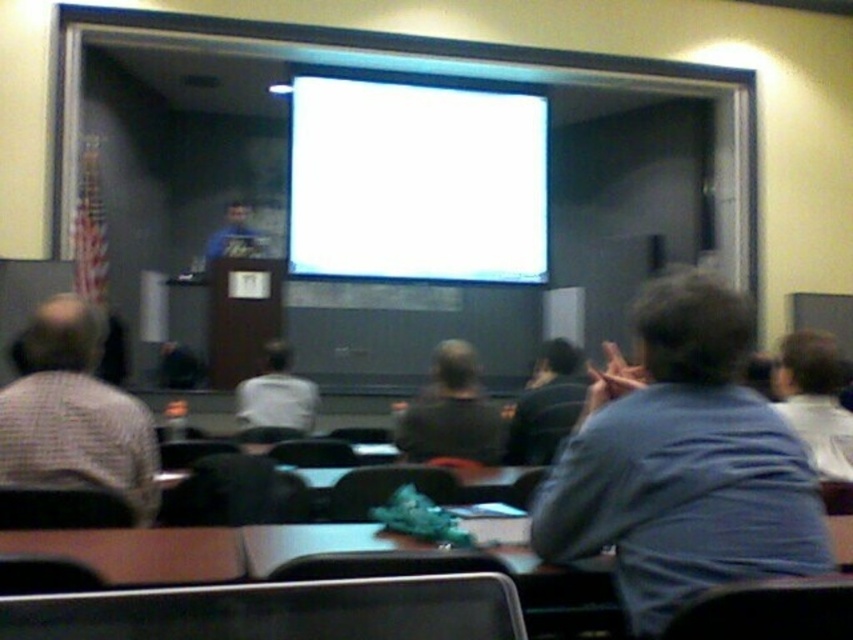
Does gray checkered shirt at left have a lesser width compared to blue fabric at center?

Yes, gray checkered shirt at left is thinner than blue fabric at center.

What do you see at coordinates (74, 412) in the screenshot? I see `gray checkered shirt at left` at bounding box center [74, 412].

Locate an element on the screen. gray checkered shirt at left is located at coordinates (74, 412).

Is point (689, 365) farther from viewer compared to point (544, 454)?

No.

Between blue shirt at right and dark blue shirt at center, which one is positioned higher?

Answer: Positioned higher is blue shirt at right.

Is point (653, 540) positioned behind point (555, 362)?

That is False.

The height and width of the screenshot is (640, 853). Identify the location of blue shirt at right. (682, 461).

Is point (640, 408) positioned behind point (822, 337)?

No, (640, 408) is in front of (822, 337).

Is blue shirt at right smaller than light blue shirt at center?

Actually, blue shirt at right might be larger than light blue shirt at center.

Where is `blue shirt at right`? blue shirt at right is located at coordinates (682, 461).